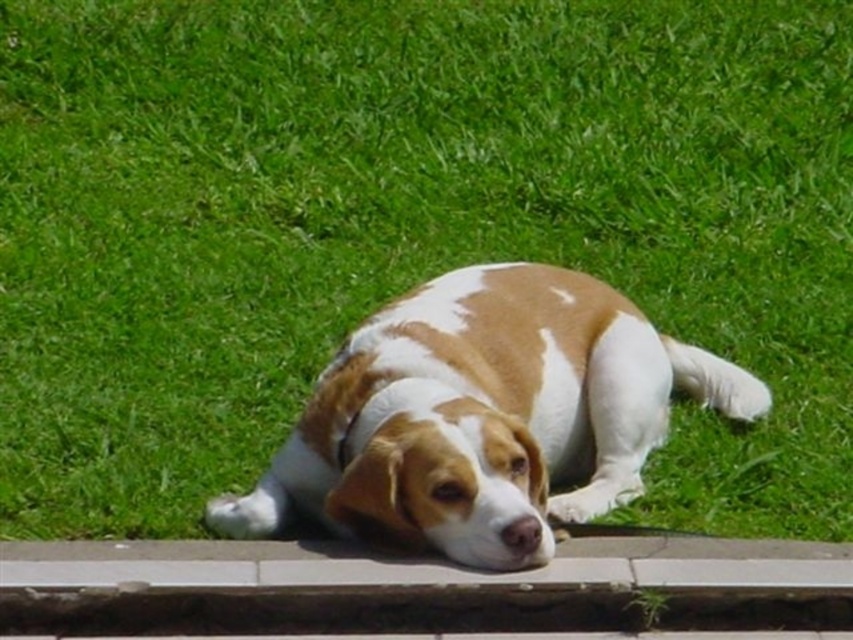
Question: Does brown and white fur dog at center appear under gray concrete curb at lower center?

Choices:
 (A) no
 (B) yes

Answer: (A)

Question: Does brown and white fur dog at center appear over gray concrete curb at lower center?

Choices:
 (A) no
 (B) yes

Answer: (B)

Question: Which of the following is the closest to the observer?

Choices:
 (A) (514, 362)
 (B) (641, 540)

Answer: (B)

Question: Is brown and white fur dog at center above gray concrete curb at lower center?

Choices:
 (A) no
 (B) yes

Answer: (B)

Question: Among these objects, which one is farthest from the camera?

Choices:
 (A) gray concrete curb at lower center
 (B) brown and white fur dog at center

Answer: (A)